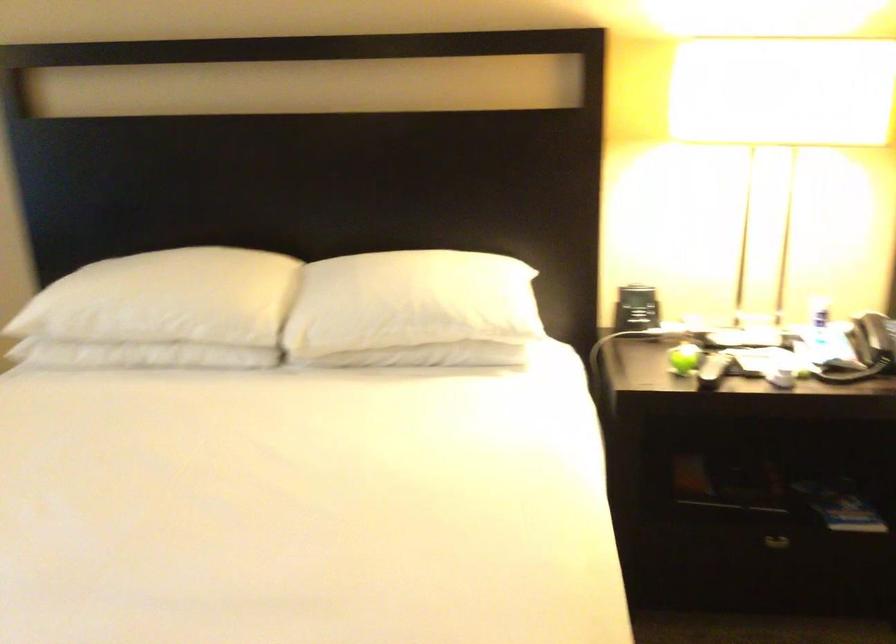
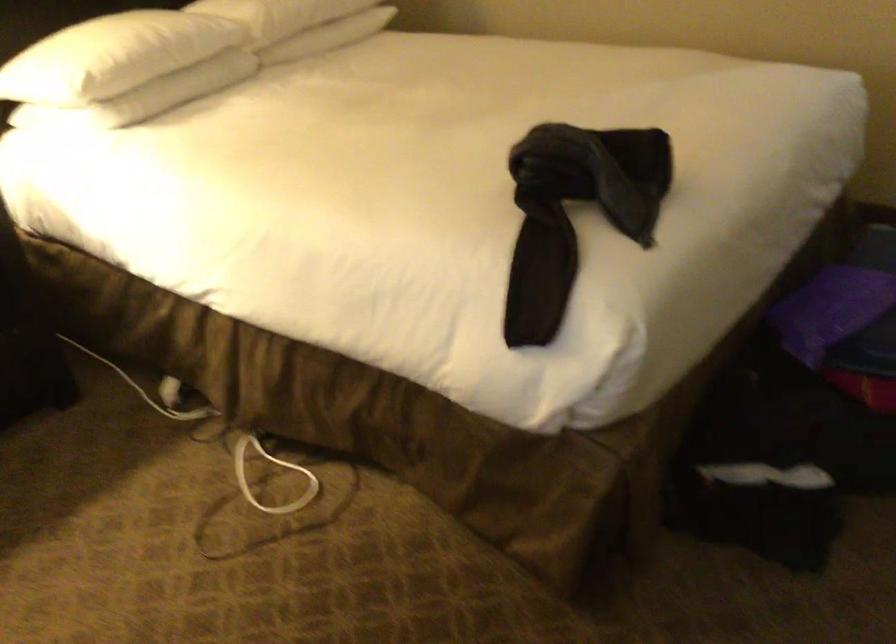
First-person continuous shooting, in which direction is the camera rotating?

The camera rotated toward right-down.